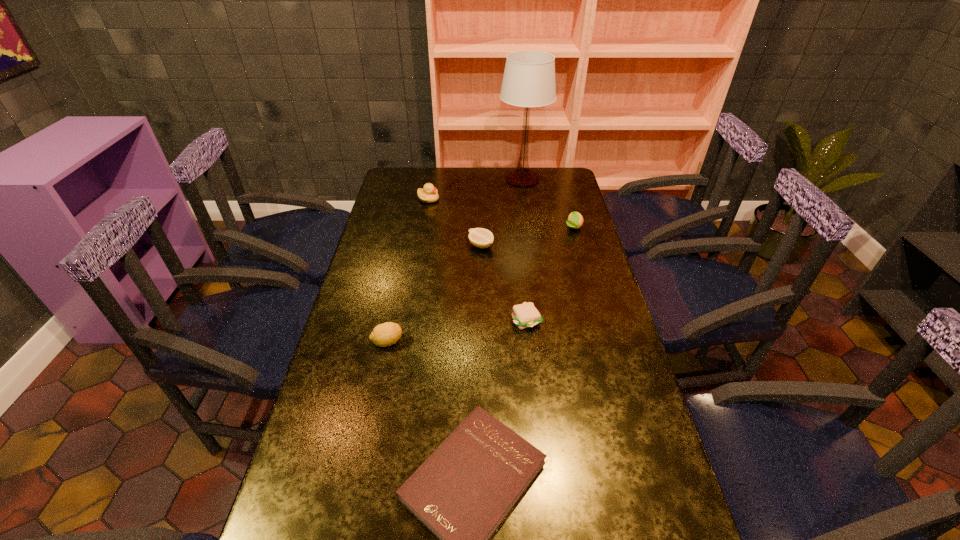
What are the coordinates of `free space between the leftmost lemon and the farthest object` in the screenshot? It's located at (455, 260).

In order to click on vacant space that is in between the rightmost lemon and the table lamp in this screenshot , I will do `click(548, 203)`.

Image resolution: width=960 pixels, height=540 pixels. Find the location of `free space between the fifth nearest object and the farthest object`. free space between the fifth nearest object and the farthest object is located at coordinates (548, 203).

At what (x,y) coordinates should I click in order to perform the action: click on object that ranks as the fifth closest to the second nearest lemon. Please return your answer as a coordinate pair (x, y). The height and width of the screenshot is (540, 960). Looking at the image, I should click on (383, 335).

Locate which object is the closest to the rightmost lemon. Please provide its 2D coordinates. Your answer should be formatted as a tuple, i.e. [(x, y)], where the tuple contains the x and y coordinates of a point satisfying the conditions above.

[(529, 77)]

The width and height of the screenshot is (960, 540). Find the location of `lemon that can be found as the closest to the hardback book`. lemon that can be found as the closest to the hardback book is located at coordinates (383, 335).

Identify the location of lemon that is the second closest to the leftmost lemon. (575, 220).

Locate an element on the screen. Image resolution: width=960 pixels, height=540 pixels. free location that satisfies the following two spatial constraints: 1. on the front side of the shortest lemon; 2. at the stem end of the nearest lemon is located at coordinates (481, 342).